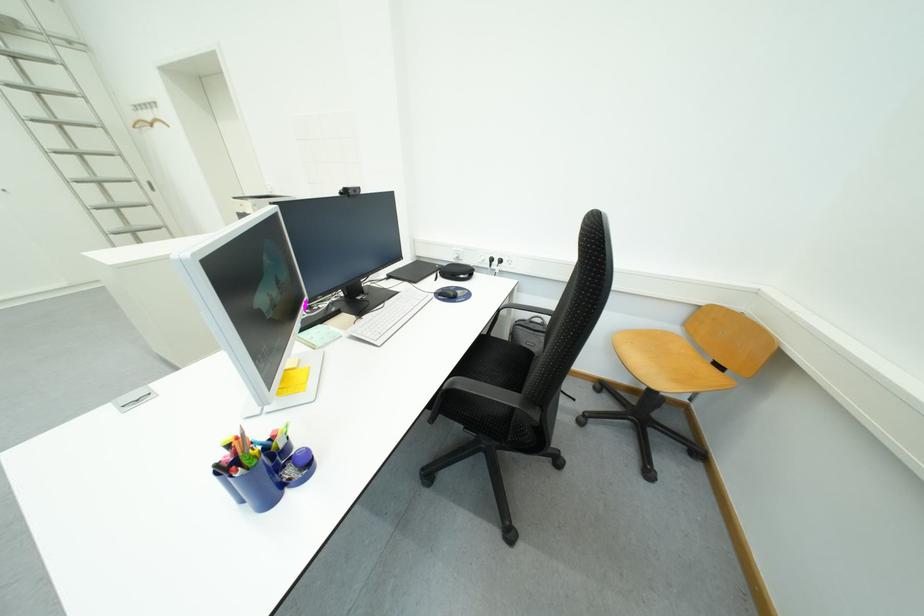
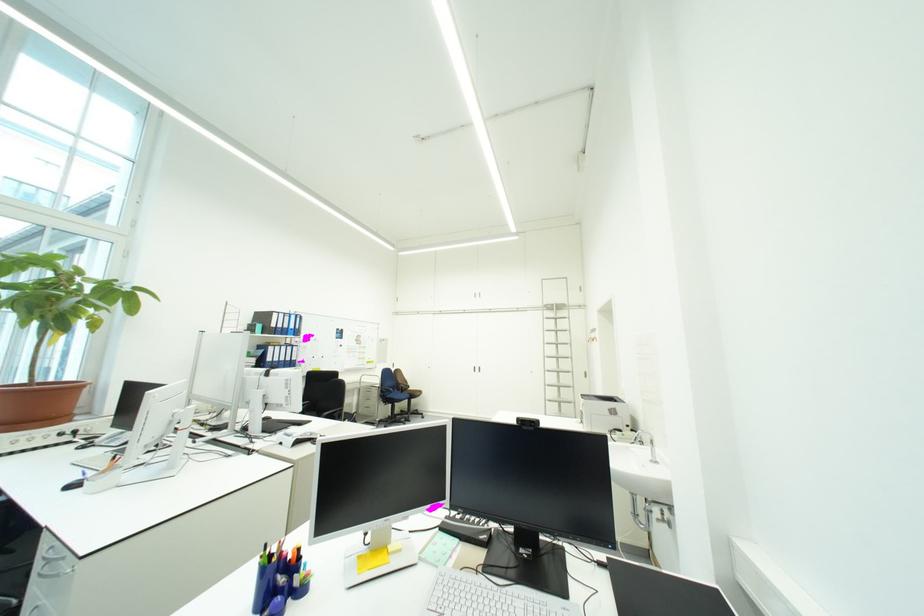
Question: The first image is from the beginning of the video and the second image is from the end. How did the camera likely rotate when shooting the video?

Choices:
 (A) Left
 (B) Right
 (C) Up
 (D) Down

Answer: (A)